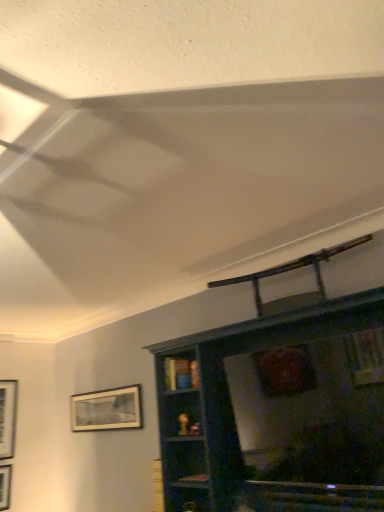
Question: From the image's perspective, relative to matte black picture frame at lower left, which is counted as the first picture frame, starting from the right, is dark wood shelf at upper center above or below?

Choices:
 (A) above
 (B) below

Answer: (A)

Question: Is point (x=243, y=460) positioned closer to the camera than point (x=122, y=426)?

Choices:
 (A) closer
 (B) farther

Answer: (A)

Question: Which of these objects is positioned farthest from the metallic silver swivel chair at upper center?

Choices:
 (A) matte black picture frame at lower left, which is counted as the first picture frame, starting from the right
 (B) matte black picture frame at left, which is the second picture frame in right-to-left order
 (C) dark wood shelf at upper center

Answer: (B)

Question: Based on their relative distances, which object is farther from the matte black picture frame at left, which is the second picture frame in right-to-left order?

Choices:
 (A) dark wood shelf at upper center
 (B) metallic silver swivel chair at upper center
 (C) matte black picture frame at lower left, which is counted as the first picture frame, starting from the right

Answer: (B)